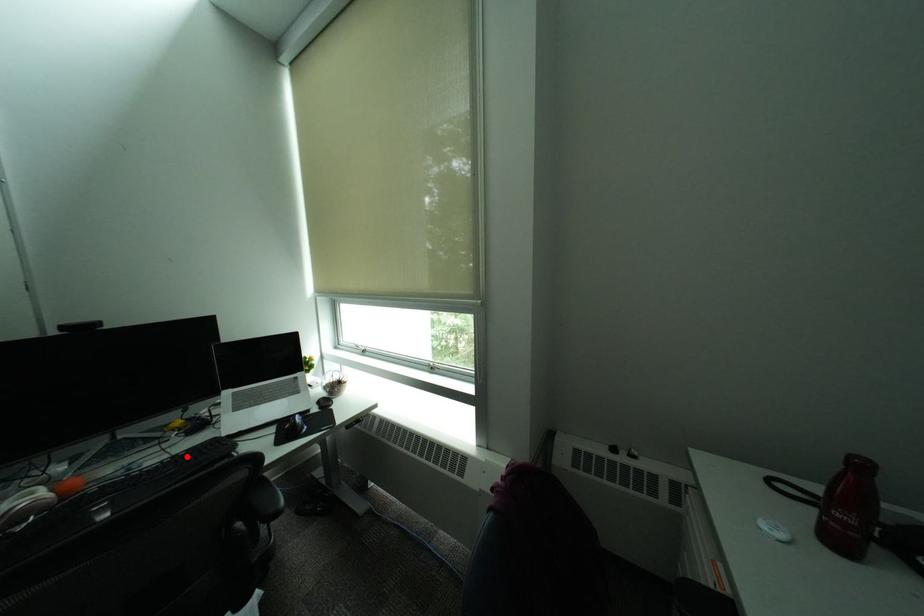
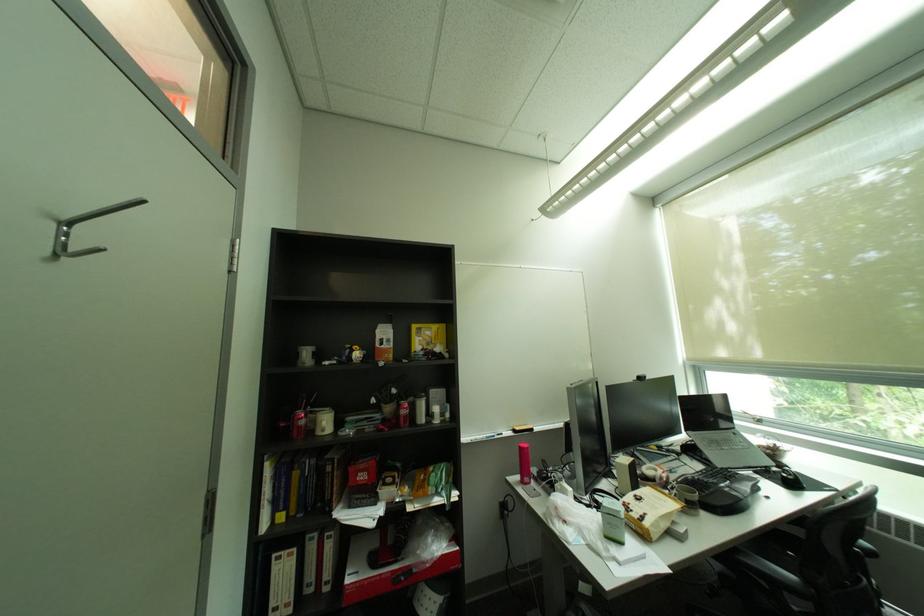
Locate, in the second image, the point that corresponds to the highlighted location in the first image.

(712, 472)